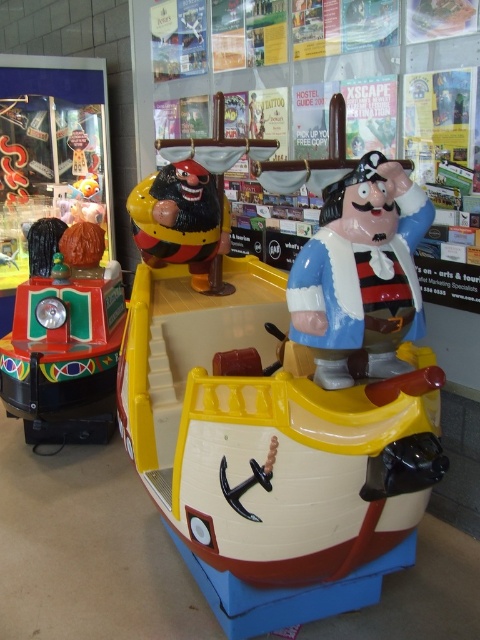
You are a child trying to see over the shiny plastic pirate ship at center to spot your friend who is standing behind it. Can you see your friend if you stand next to the shiny plastic pirate at center?

The shiny plastic pirate ship at center is taller than the shiny plastic pirate at center. Since the ship is taller, standing next to the pirate might block your view, making it difficult to see your friend behind the ship.

You are standing at the point marked as point (337, 340) in the image. There is a fairground ride boat in front of you. If you want to move 2 meters forward, will you be able to reach the boat?

The distance between point (337, 340) and the viewer is 1.81 meters. Moving 2 meters forward from this point would exceed the available distance, so you will not be able to reach the boat by moving forward 2 meters.